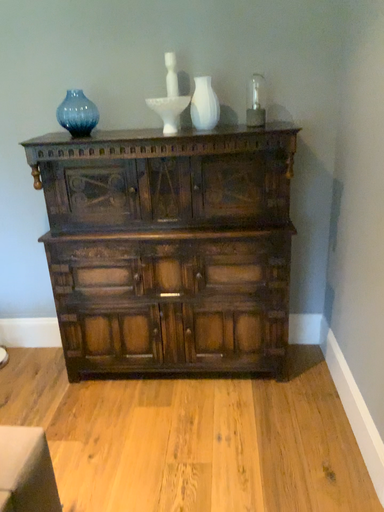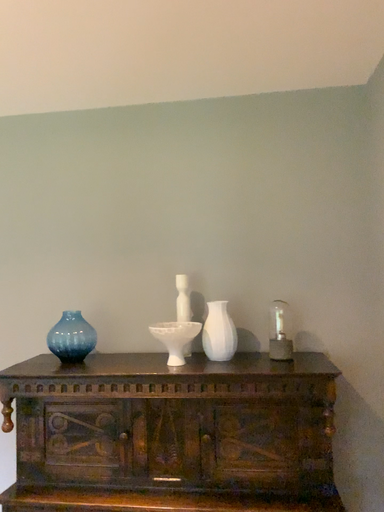
Question: How did the camera likely rotate when shooting the video?

Choices:
 (A) rotated upward
 (B) rotated downward

Answer: (A)